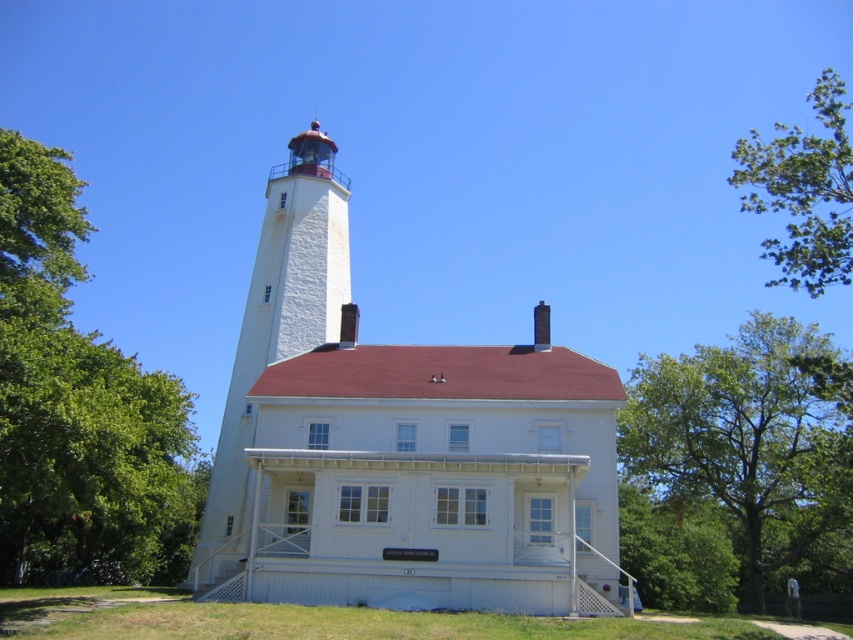
Question: Among these points, which one is nearest to the camera?

Choices:
 (A) (836, 584)
 (B) (322, 627)
 (C) (54, 552)

Answer: (B)

Question: Is white stucco lighthouse at center smaller than green leafy tree at upper right?

Choices:
 (A) yes
 (B) no

Answer: (A)

Question: From the image, what is the correct spatial relationship of green leafy tree at left in relation to green leafy tree at upper right?

Choices:
 (A) left
 (B) right

Answer: (A)

Question: Which of the following is the closest to the observer?

Choices:
 (A) tap(641, 417)
 (B) tap(24, 598)

Answer: (B)

Question: Based on their relative distances, which object is farther from the green leafy tree at upper right?

Choices:
 (A) green leafy tree at left
 (B) white stucco lighthouse at center
 (C) white stucco tower at upper center
 (D) green grass at lower center

Answer: (A)

Question: Does white stucco lighthouse at center come in front of green grass at lower center?

Choices:
 (A) yes
 (B) no

Answer: (B)